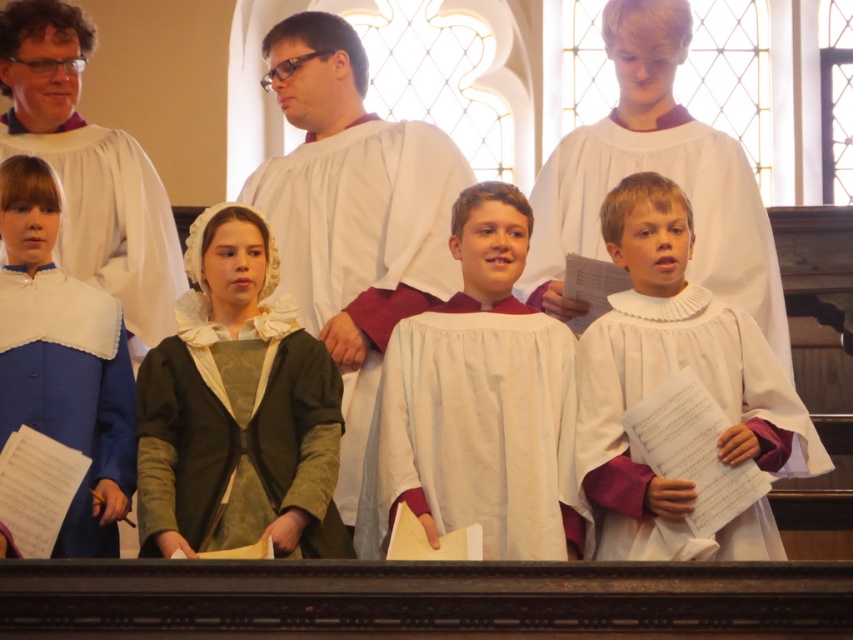
Between point (405, 355) and point (119, 326), which one is positioned behind?

The point (119, 326) is more distant.

Between white matte choir robe at center and blue satin robe at left, which one appears on the right side from the viewer's perspective?

white matte choir robe at center

Find the location of a particular element. white matte choir robe at center is located at coordinates (483, 397).

What are the coordinates of `white matte choir robe at center` in the screenshot? It's located at (483, 397).

Describe the element at coordinates (238, 433) in the screenshot. I see `green suede robe at center` at that location.

Is point (186, 534) positioned behind point (6, 237)?

No.

Who is more forward, (165,349) or (73,412)?

Point (73,412)

This screenshot has height=640, width=853. Identify the location of green suede robe at center. (238, 433).

Does green suede robe at center have a greater width compared to green textured fabric robe at center?

In fact, green suede robe at center might be narrower than green textured fabric robe at center.

Which is in front, point (144, 406) or point (361, 177)?

Point (144, 406) is more forward.

The width and height of the screenshot is (853, 640). Find the location of `green suede robe at center`. green suede robe at center is located at coordinates (238, 433).